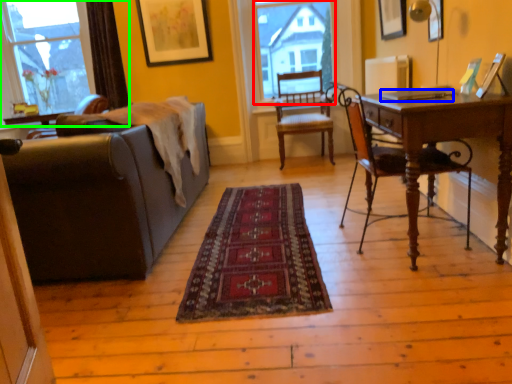
Question: Based on their relative distances, which object is farther from bay window (highlighted by a red box)? Choose from laptop (highlighted by a blue box) and window (highlighted by a green box).

Choices:
 (A) laptop
 (B) window

Answer: (A)